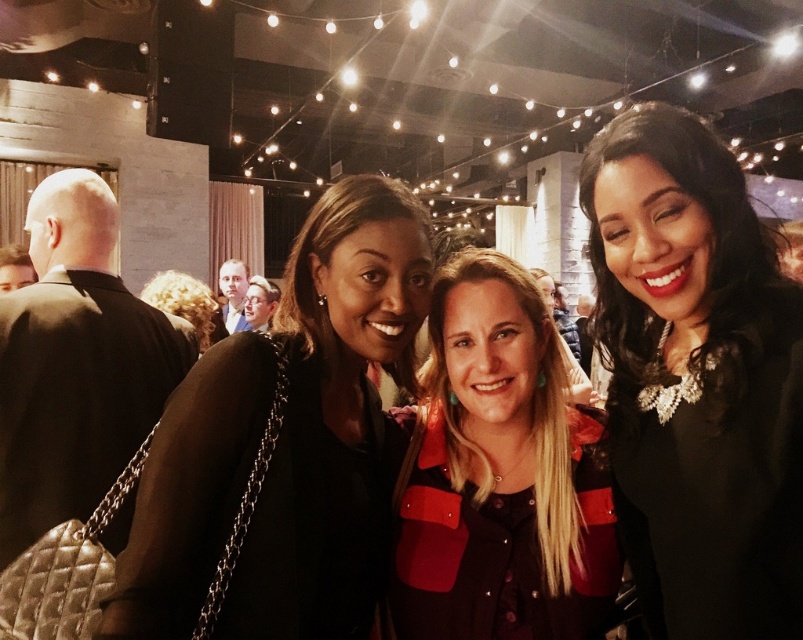
Between point (247, 592) and point (547, 588), which one is positioned in front?

Point (247, 592) is more forward.

Which is above, matte black jacket at left or matte black jacket at center?

matte black jacket at left is higher up.

Who is more distant from viewer, (406,256) or (443,339)?

Positioned behind is point (443,339).

I want to click on matte black jacket at left, so click(284, 444).

Is black shiny necklace at upper right bigger than matte black jacket at center?

Correct, black shiny necklace at upper right is larger in size than matte black jacket at center.

This screenshot has height=640, width=803. What do you see at coordinates (696, 380) in the screenshot?
I see `black shiny necklace at upper right` at bounding box center [696, 380].

Locate an element on the screen. The width and height of the screenshot is (803, 640). black shiny necklace at upper right is located at coordinates 696,380.

Does black shiny necklace at upper right appear on the left side of matte black jacket at left?

No, black shiny necklace at upper right is not to the left of matte black jacket at left.

Image resolution: width=803 pixels, height=640 pixels. Find the location of `black shiny necklace at upper right`. black shiny necklace at upper right is located at coordinates (696, 380).

What do you see at coordinates (696, 380) in the screenshot?
I see `black shiny necklace at upper right` at bounding box center [696, 380].

Where is `black shiny necklace at upper right`? The width and height of the screenshot is (803, 640). black shiny necklace at upper right is located at coordinates (696, 380).